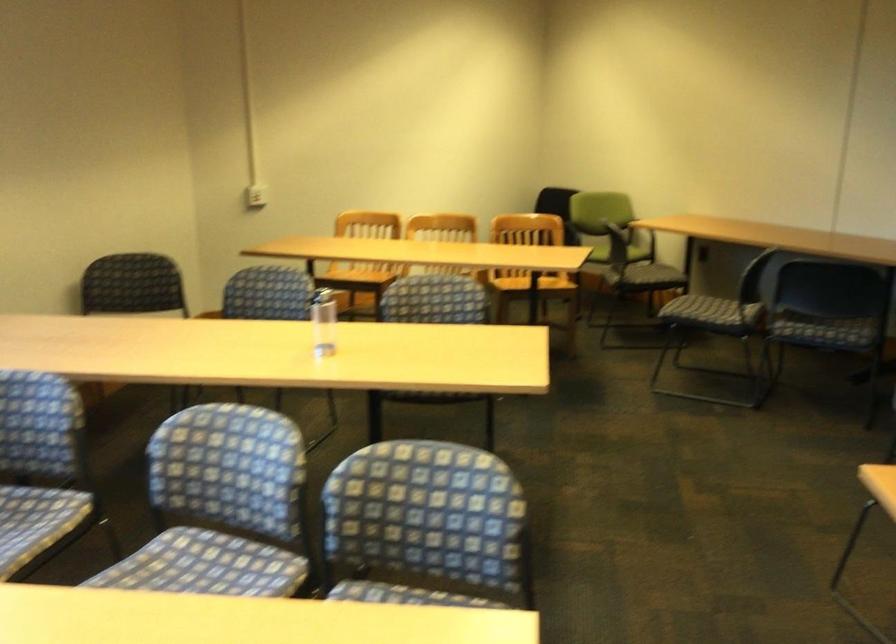
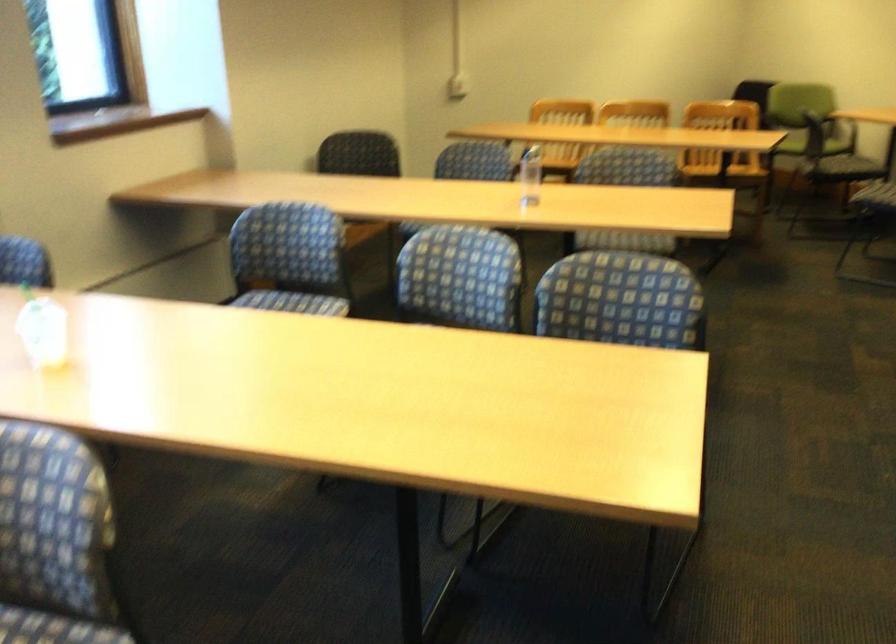
The point at (253, 200) is marked in the first image. Where is the corresponding point in the second image?

(458, 86)